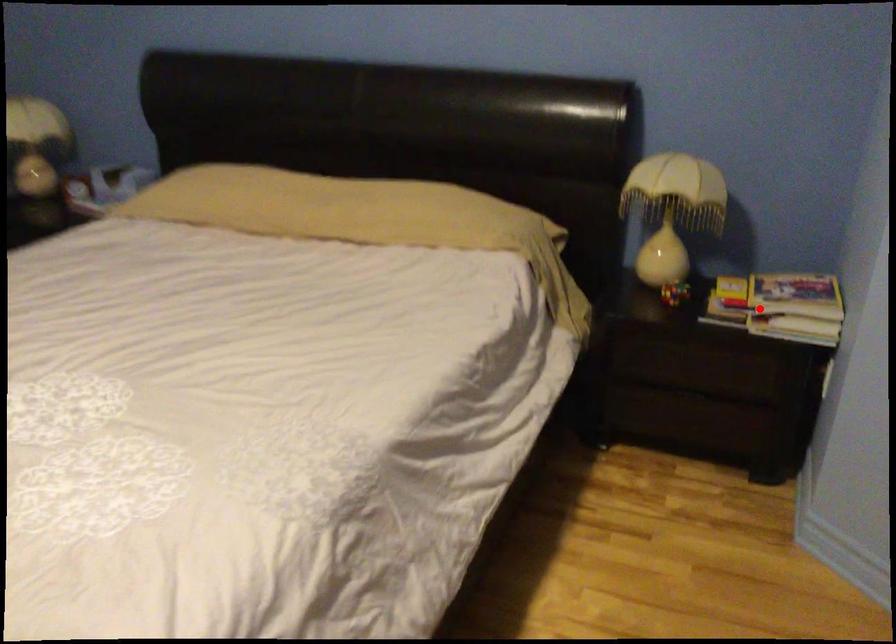
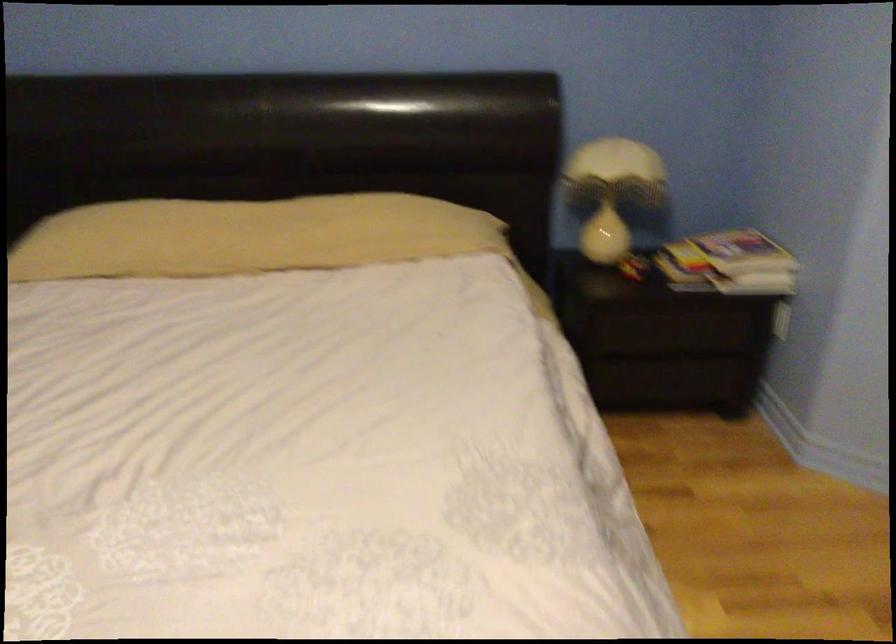
In the second image, find the point that corresponds to the highlighted location in the first image.

(728, 263)